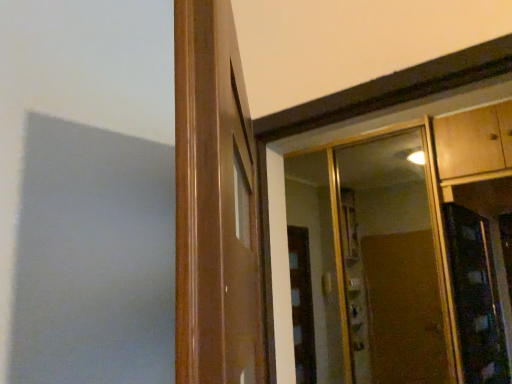
Question: Considering the relative sizes of clear glass mirror at upper right and wooden cabinet at upper right in the image provided, is clear glass mirror at upper right thinner than wooden cabinet at upper right?

Choices:
 (A) yes
 (B) no

Answer: (A)

Question: Is the surface of clear glass mirror at upper right in direct contact with wooden cabinet at upper right?

Choices:
 (A) yes
 (B) no

Answer: (B)

Question: Does clear glass mirror at upper right have a greater width compared to wooden cabinet at upper right?

Choices:
 (A) no
 (B) yes

Answer: (A)

Question: Is clear glass mirror at upper right positioned with its back to wooden cabinet at upper right?

Choices:
 (A) no
 (B) yes

Answer: (A)

Question: From the image's perspective, is clear glass mirror at upper right above wooden cabinet at upper right?

Choices:
 (A) yes
 (B) no

Answer: (B)

Question: Considering the relative positions of clear glass mirror at upper right and wooden cabinet at upper right in the image provided, is clear glass mirror at upper right to the left of wooden cabinet at upper right from the viewer's perspective?

Choices:
 (A) yes
 (B) no

Answer: (A)

Question: Could you tell me if wooden cabinet at upper right is turned towards wooden door frame at center?

Choices:
 (A) yes
 (B) no

Answer: (B)

Question: Is wooden cabinet at upper right bigger than wooden door frame at center?

Choices:
 (A) no
 (B) yes

Answer: (B)

Question: Is wooden cabinet at upper right next to wooden door frame at center and touching it?

Choices:
 (A) no
 (B) yes

Answer: (A)

Question: Considering the relative sizes of wooden cabinet at upper right and wooden door frame at center in the image provided, is wooden cabinet at upper right smaller than wooden door frame at center?

Choices:
 (A) no
 (B) yes

Answer: (A)

Question: Would you say wooden door frame at center is part of wooden cabinet at upper right's contents?

Choices:
 (A) no
 (B) yes

Answer: (A)

Question: Does wooden cabinet at upper right appear on the right side of wooden door frame at center?

Choices:
 (A) yes
 (B) no

Answer: (A)

Question: From the image's perspective, does clear glass mirror at upper right appear lower than wooden door frame at center?

Choices:
 (A) no
 (B) yes

Answer: (B)